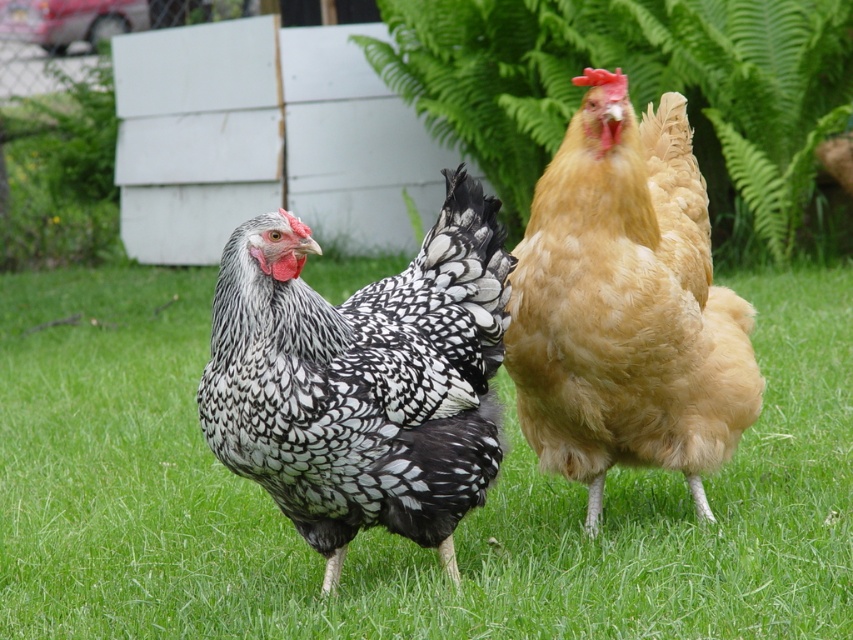
Question: Which point is farther from the camera taking this photo?

Choices:
 (A) (514, 93)
 (B) (102, 557)

Answer: (A)

Question: Does speckled feathered chicken at center appear on the left side of golden fluffy chicken at center?

Choices:
 (A) no
 (B) yes

Answer: (B)

Question: Which point is closer to the camera?

Choices:
 (A) green grass at center
 (B) golden fluffy chicken at center
 (C) speckled feathered chicken at center
 (D) green leafy fern at upper center

Answer: (C)

Question: Does green grass at center have a smaller size compared to speckled feathered chicken at center?

Choices:
 (A) yes
 (B) no

Answer: (A)

Question: Can you confirm if green grass at center is positioned to the left of golden fluffy chicken at center?

Choices:
 (A) yes
 (B) no

Answer: (A)

Question: Which point is closer to the camera taking this photo?

Choices:
 (A) (x=573, y=60)
 (B) (x=705, y=429)
 (C) (x=326, y=440)

Answer: (C)